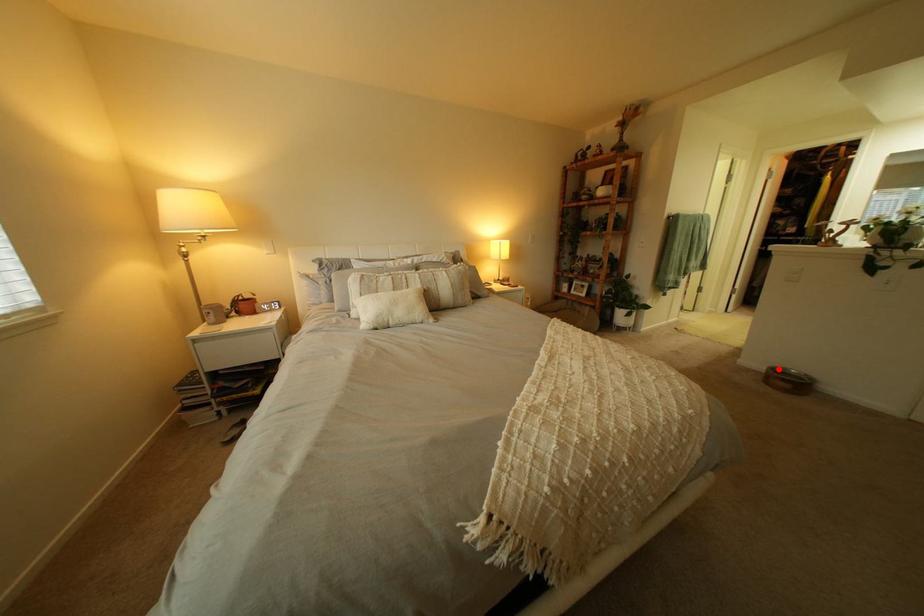
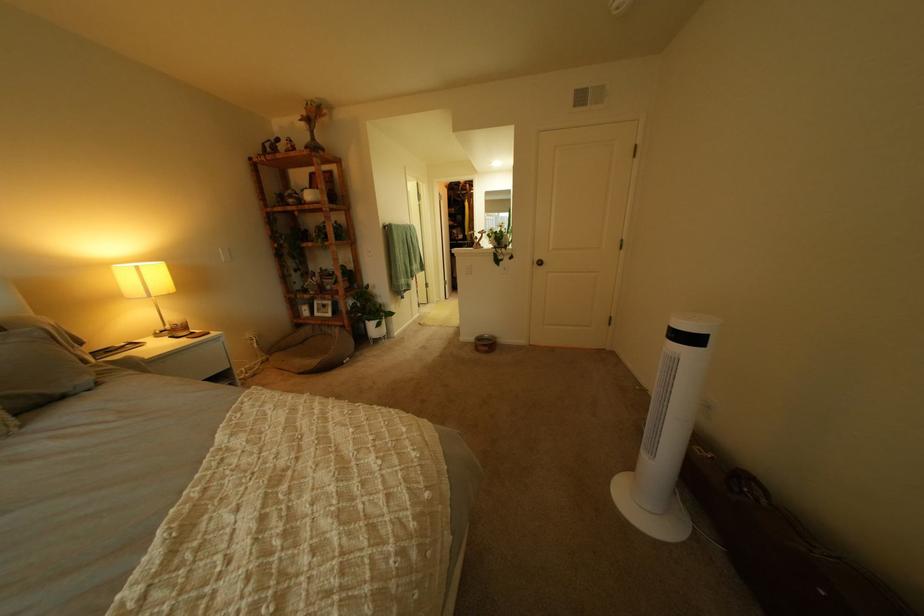
Find the pixel in the second image that matches the highlighted location in the first image.

(489, 339)